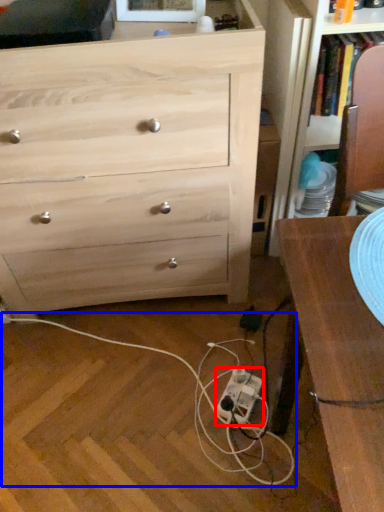
Question: Which of the following is the farthest to the observer, extension cord (highlighted by a red box) or string (highlighted by a blue box)?

Choices:
 (A) extension cord
 (B) string

Answer: (A)